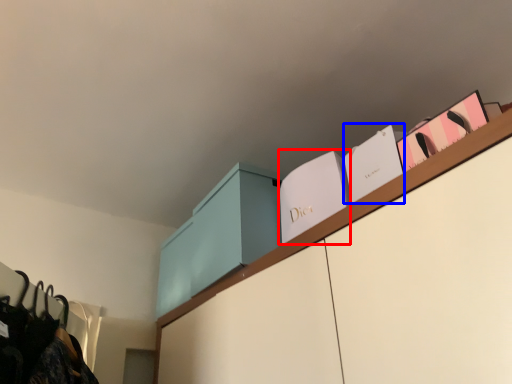
Question: Which of the following is the farthest to the observer, book (highlighted by a red box) or book (highlighted by a blue box)?

Choices:
 (A) book
 (B) book

Answer: (A)